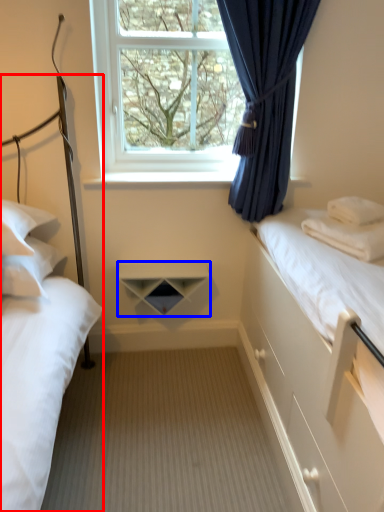
Question: Which point is closer to the camera, bed (highlighted by a red box) or shelf (highlighted by a blue box)?

Choices:
 (A) bed
 (B) shelf

Answer: (A)